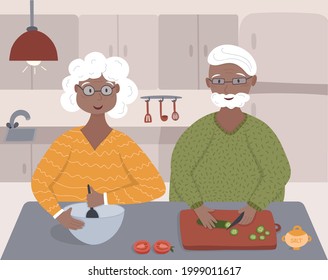
Where is `sink`? Image resolution: width=328 pixels, height=280 pixels. sink is located at coordinates (23, 138).